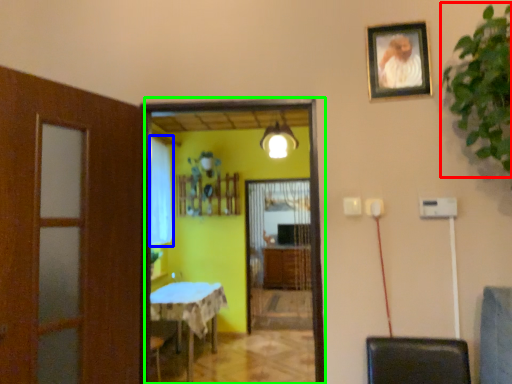
Question: Estimate the real-world distances between objects in this image. Which object is farther from plant (highlighted by a red box), curtain (highlighted by a blue box) or screen door (highlighted by a green box)?

Choices:
 (A) curtain
 (B) screen door

Answer: (A)